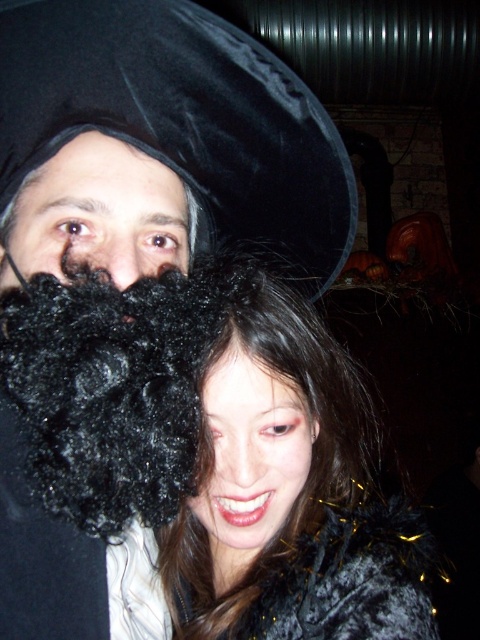
Is velvet black hat at upper center thinner than matte black hair at center?

No, velvet black hat at upper center is not thinner than matte black hair at center.

Between point (0, 77) and point (227, 554), which one is positioned behind?

Positioned behind is point (227, 554).

Where is `velvet black hat at upper center`? velvet black hat at upper center is located at coordinates (182, 120).

Can you confirm if curly black fur at left is thinner than matte black hair at center?

No.

Who is more forward, (94,380) or (222,483)?

Positioned in front is point (94,380).

This screenshot has height=640, width=480. I want to click on curly black fur at left, so click(112, 388).

Is black fuzzy wig at center in front of curly black fur at left?

No, black fuzzy wig at center is further to the viewer.

Which is behind, point (227, 570) or point (190, 474)?

The point (227, 570) is more distant.

Which is in front, point (199, 500) or point (35, 358)?

Positioned in front is point (35, 358).

The image size is (480, 640). In order to click on black fuzzy wig at center in this screenshot , I will do `click(279, 496)`.